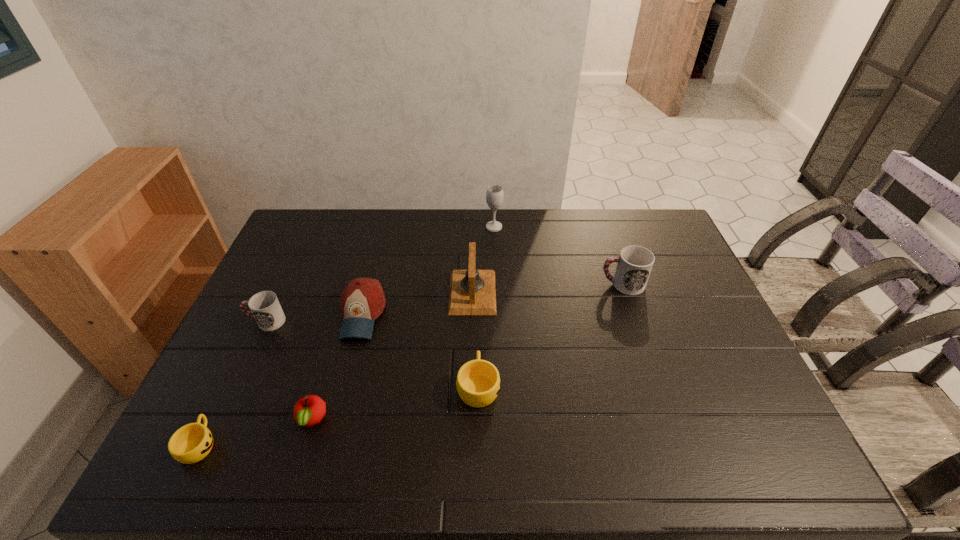
Locate an element on the screen. apple is located at coordinates (310, 410).

Where is `the nearer beige cup`? The width and height of the screenshot is (960, 540). the nearer beige cup is located at coordinates (191, 443).

Where is `the nearest cup`? The height and width of the screenshot is (540, 960). the nearest cup is located at coordinates (191, 443).

Image resolution: width=960 pixels, height=540 pixels. Identify the location of vacant area situated on the front of the wineglass. (497, 309).

This screenshot has width=960, height=540. What are the coordinates of `vacant space located 0.060m on the right of the bell` in the screenshot? It's located at (515, 292).

Locate an element on the screen. vacant area situated on the handle side of the sixth shortest object is located at coordinates click(512, 284).

Locate an element on the screen. This screenshot has width=960, height=540. free spot located 0.100m on the handle side of the sixth shortest object is located at coordinates (568, 284).

Where is `vacant space situated 0.320m on the handle side of the sixth shortest object`? vacant space situated 0.320m on the handle side of the sixth shortest object is located at coordinates (499, 284).

Where is `vacant position located on the front-facing side of the baseball cap`? vacant position located on the front-facing side of the baseball cap is located at coordinates (324, 463).

Find the location of a particular element. free location located 0.210m on the right of the second shortest cup is located at coordinates (582, 386).